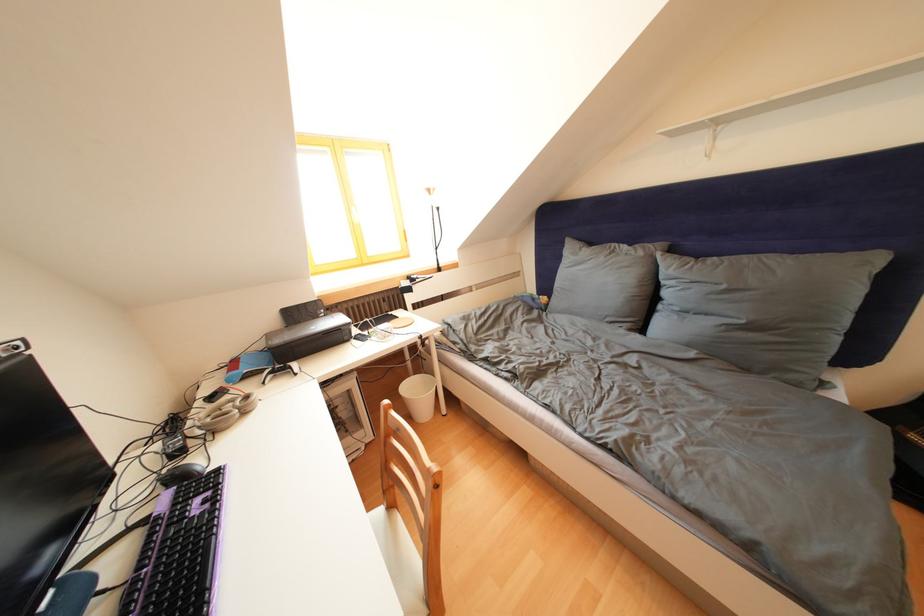
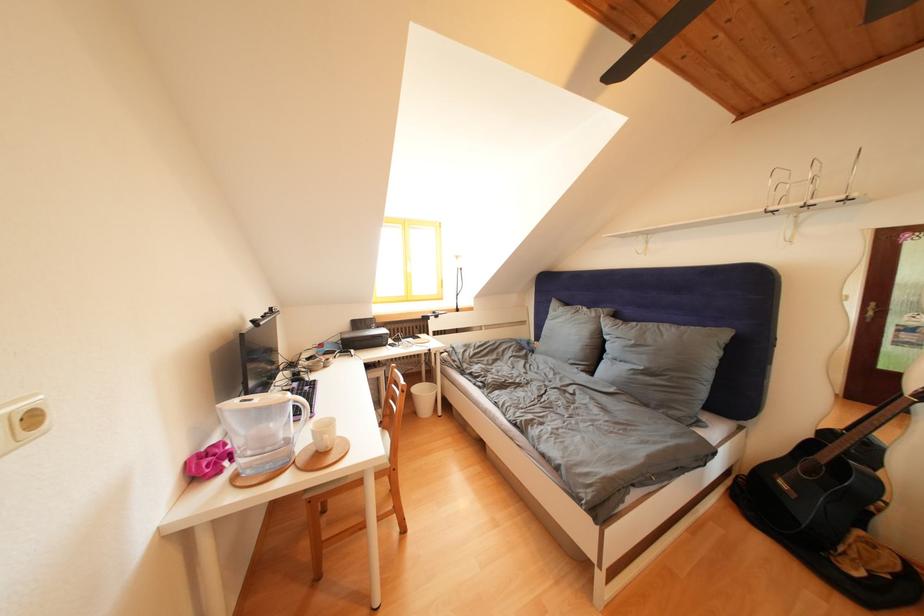
Find the pixel in the second image that matches (599,248) in the first image.

(575, 310)